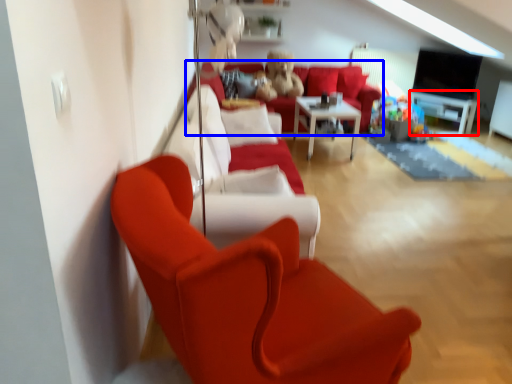
Question: Which object is further to the camera taking this photo, entertainment center (highlighted by a red box) or studio couch (highlighted by a blue box)?

Choices:
 (A) entertainment center
 (B) studio couch

Answer: (A)